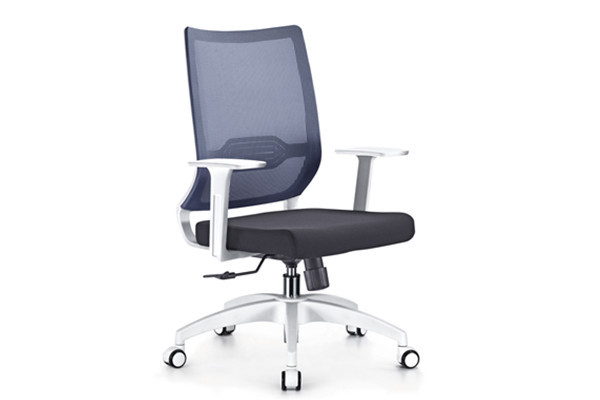
Identify the location of space between seat and back rest. This screenshot has width=600, height=400. (248, 208).